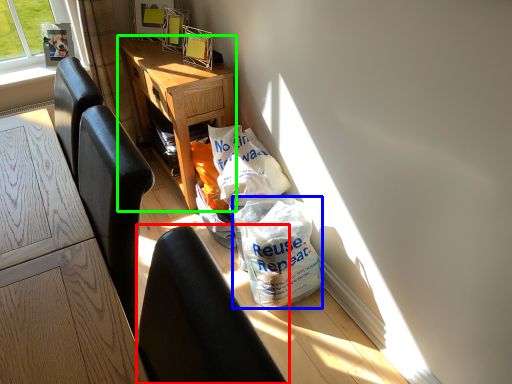
Question: Estimate the real-world distances between objects in this image. Which object is farther from chair (highlighted by a red box), plastic bag (highlighted by a blue box) or desk (highlighted by a green box)?

Choices:
 (A) plastic bag
 (B) desk

Answer: (B)